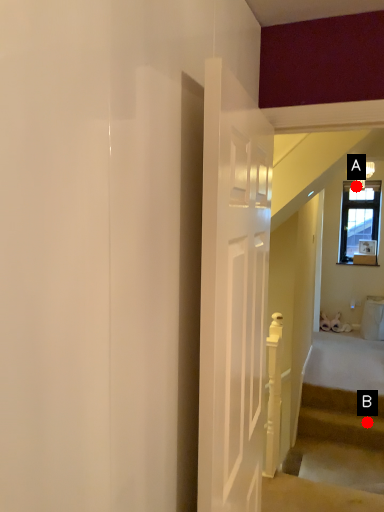
Question: Two points are circled on the image, labeled by A and B beside each circle. Which point is further to the camera?

Choices:
 (A) A is further
 (B) B is further

Answer: (A)